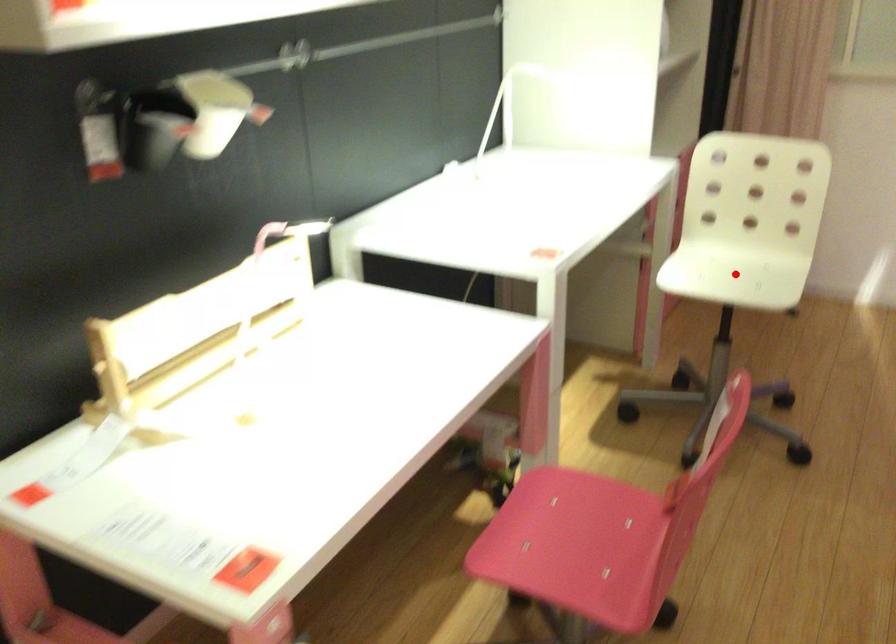
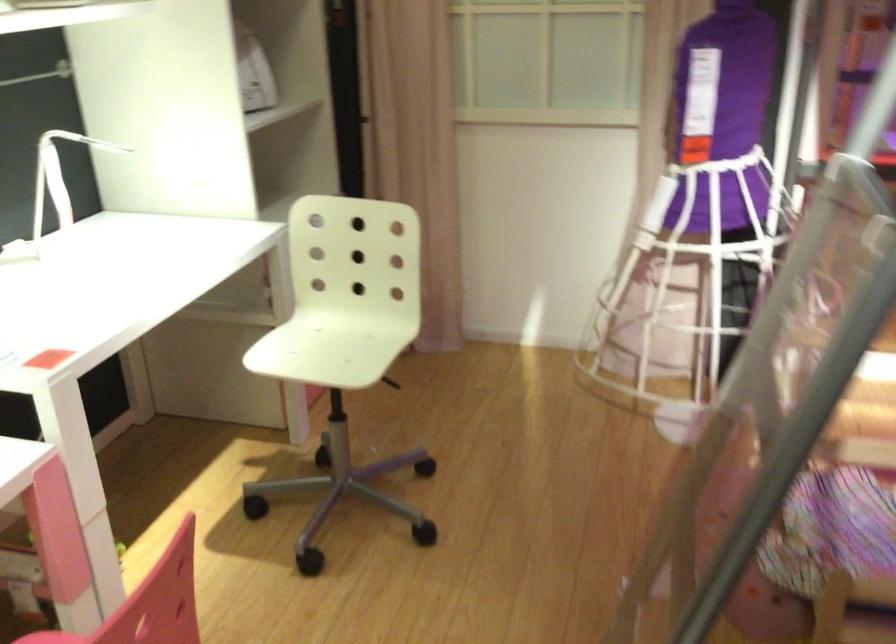
Locate, in the second image, the point that corresponds to the highlighted location in the first image.

(331, 345)